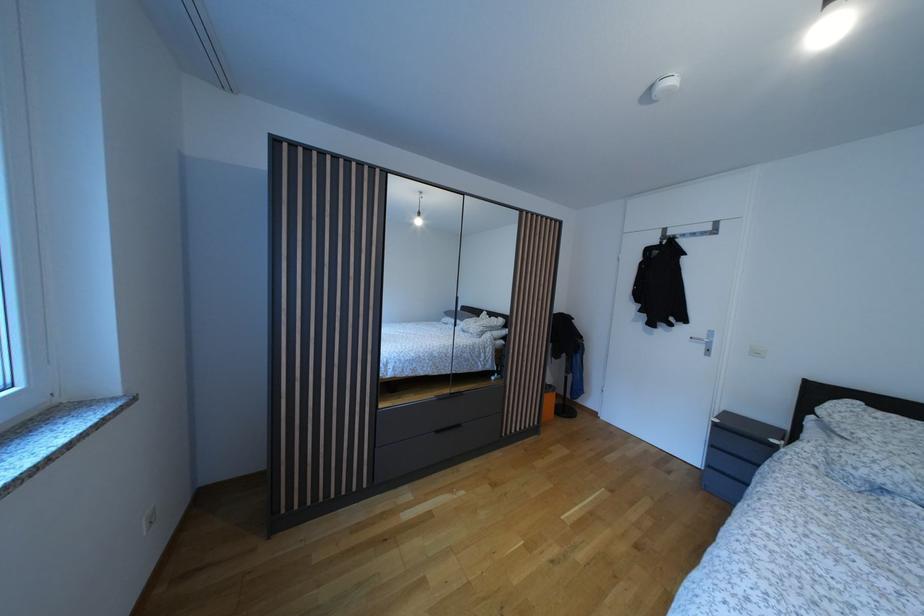
The width and height of the screenshot is (924, 616). I want to click on grey drawer pull, so pos(740,432).